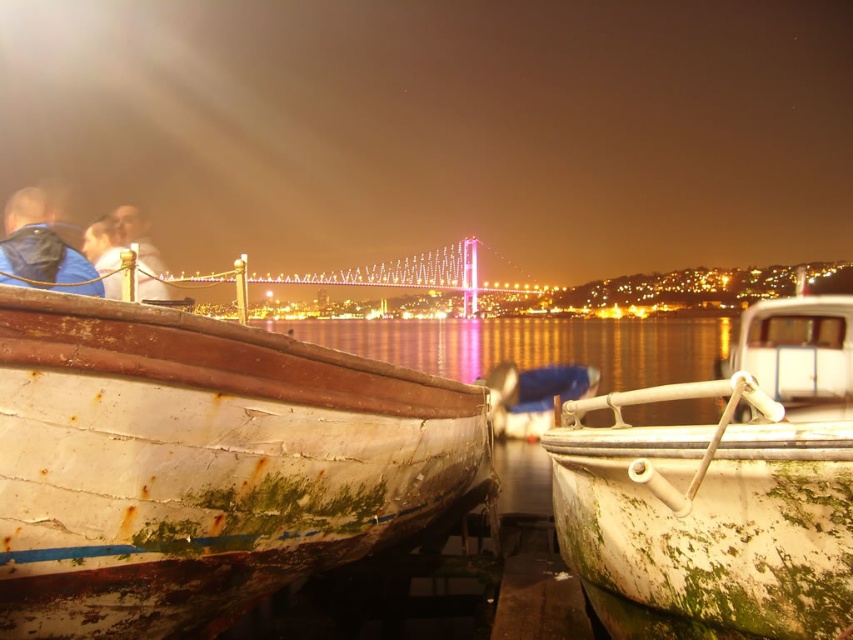
Question: Does rusty metal water at center appear on the left side of matte white shirt at left?

Choices:
 (A) yes
 (B) no

Answer: (B)

Question: Can you confirm if green mossy wood boat at right is smaller than matte white shirt at left?

Choices:
 (A) yes
 (B) no

Answer: (A)

Question: Which of the following is the farthest from the observer?

Choices:
 (A) matte white shirt at left
 (B) rusty metal water at center

Answer: (A)

Question: Which is farther from the rusty wood boat at left?

Choices:
 (A) matte white shirt at left
 (B) matte blue jacket at left
 (C) green mossy wood boat at right
 (D) rusty metal water at center

Answer: (B)

Question: Is green mossy wood boat at right smaller than matte white shirt at left?

Choices:
 (A) yes
 (B) no

Answer: (A)

Question: Among these objects, which one is farthest from the camera?

Choices:
 (A) matte white shirt at left
 (B) matte blue jacket at left
 (C) rusty metal water at center
 (D) green mossy wood boat at right

Answer: (A)